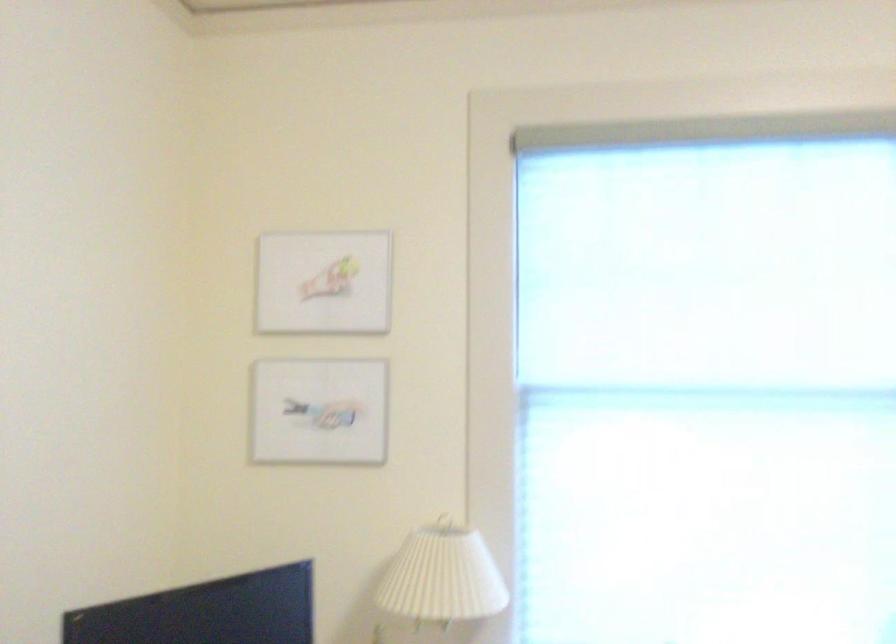
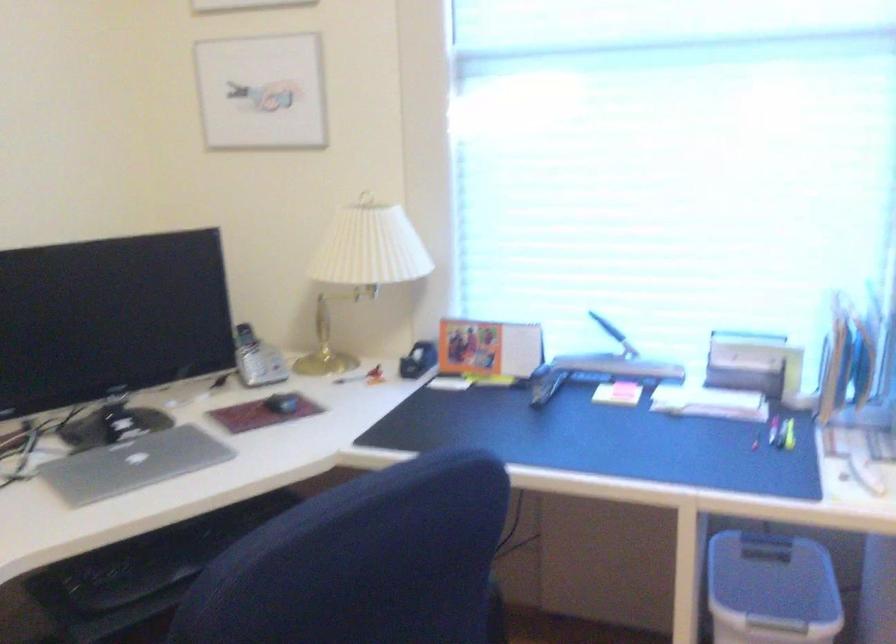
Question: What movement of the cameraman would produce the second image?

Choices:
 (A) Left
 (B) Right
 (C) Forward
 (D) Backward

Answer: (B)